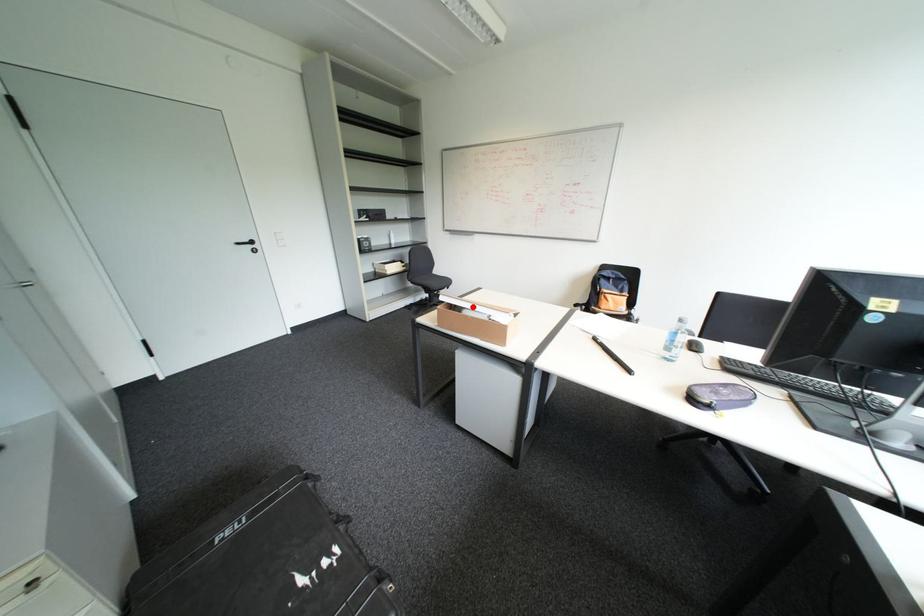
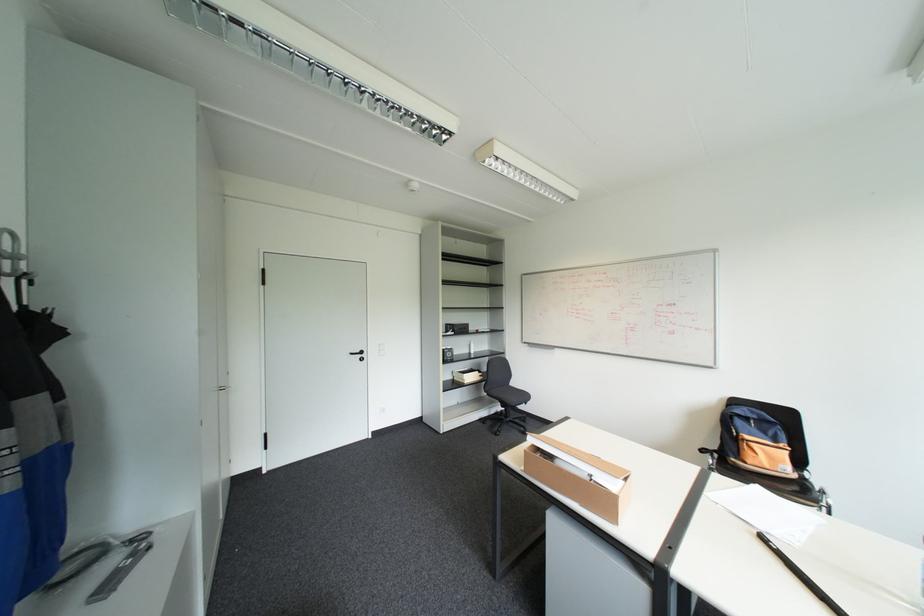
Question: I am providing you with two images of the same scene from different viewpoints. Given a red point in image1, look at the same physical point in image2. Is it:

Choices:
 (A) Closer to the viewpoint
 (B) Farther from the viewpoint

Answer: (A)